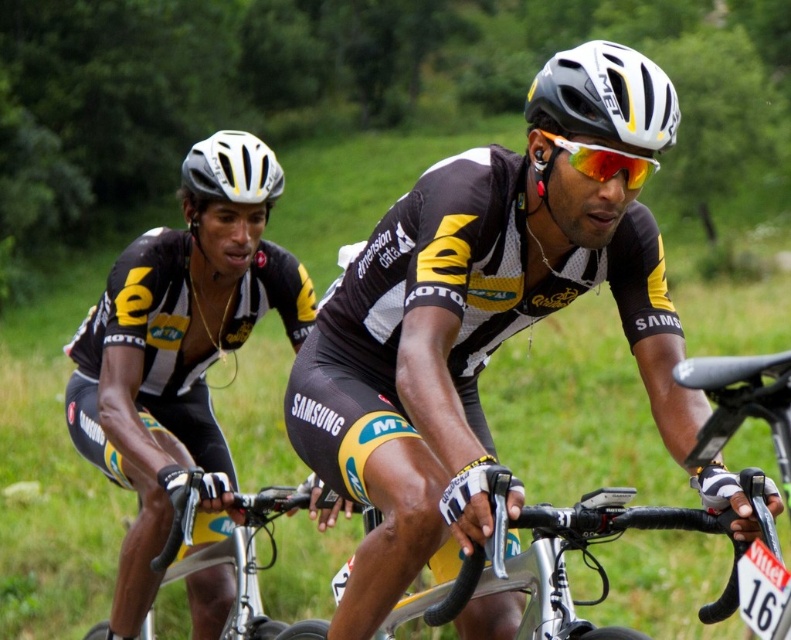
Measure the distance from yellow matte bicycle handlebars at center to white matte bicycle helmet at upper left.

1.45 meters

Who is more distant from viewer, (x=282, y=509) or (x=218, y=192)?

Positioned behind is point (x=218, y=192).

You are a GUI agent. You are given a task and a screenshot of the screen. Output one action in this format:
    pyautogui.click(x=<x>, y=<y>)
    Task: Click on the yellow matte bicycle handlebars at center
    The height and width of the screenshot is (640, 791).
    Given the screenshot: What is the action you would take?
    pyautogui.click(x=244, y=552)

Who is higher up, matte black cycling jersey at left or yellow matte bicycle handlebars at center?

matte black cycling jersey at left

Which is more to the right, matte black cycling jersey at left or yellow matte bicycle handlebars at center?

yellow matte bicycle handlebars at center is more to the right.

What do you see at coordinates (178, 344) in the screenshot? I see `matte black cycling jersey at left` at bounding box center [178, 344].

The height and width of the screenshot is (640, 791). Find the location of `matte black cycling jersey at left`. matte black cycling jersey at left is located at coordinates (178, 344).

Is white matte bicycle helmet at upper center to the left of yellow matte bicycle handlebars at center from the viewer's perspective?

Incorrect, white matte bicycle helmet at upper center is not on the left side of yellow matte bicycle handlebars at center.

Is white matte bicycle helmet at upper center closer to the viewer compared to yellow matte bicycle handlebars at center?

Yes, it is in front of yellow matte bicycle handlebars at center.

Find the location of `white matte bicycle helmet at upper center`. white matte bicycle helmet at upper center is located at coordinates [604, 97].